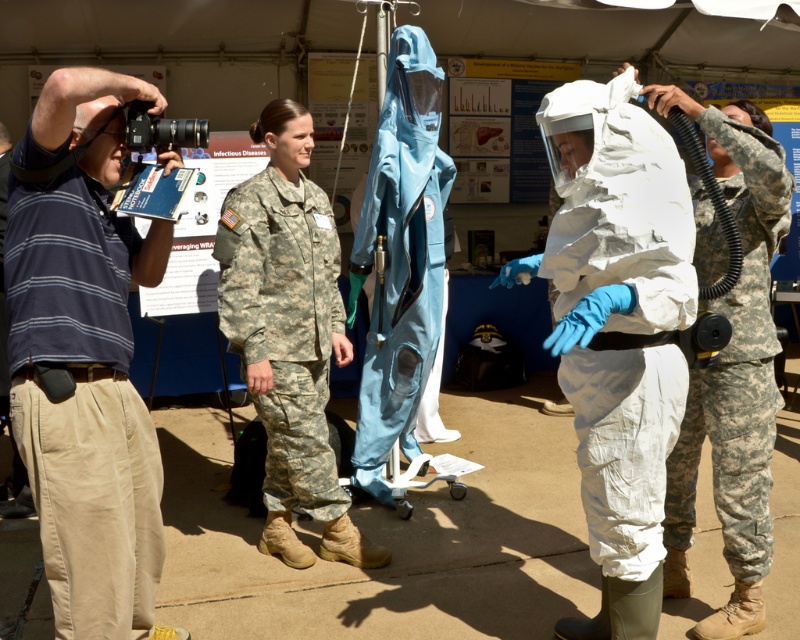
A photographer is taking a picture of a military woman. The photographer is at point (342, 330). The woman is 13.38 feet away from the photographer. If the photographer wants to get a closer shot without moving, what should they do?

The photographer should zoom in on the military woman to get a closer shot without moving since they are 13.38 feet apart.

You are a photographer standing at the edge of the tent. You need to capture a photo that includes both the white matte hazmat suit at center and the camouflage fabric uniform at right. Given their current positions, will they both fit in your camera frame if the maximum width your camera can capture is 25 inches?

The white matte hazmat suit at center and camouflage fabric uniform at right are 25.23 inches apart. Since the distance between them exceeds the camera frame width of 25 inches, they will not both fit within the frame.

You are a photographer at the event and need to capture a clear shot of both the white matte hazmat suit at center and the camouflage fabric uniform at right. Based on their positions, which object is higher in the frame?

The white matte hazmat suit at center is higher in the frame than the camouflage fabric uniform at right.